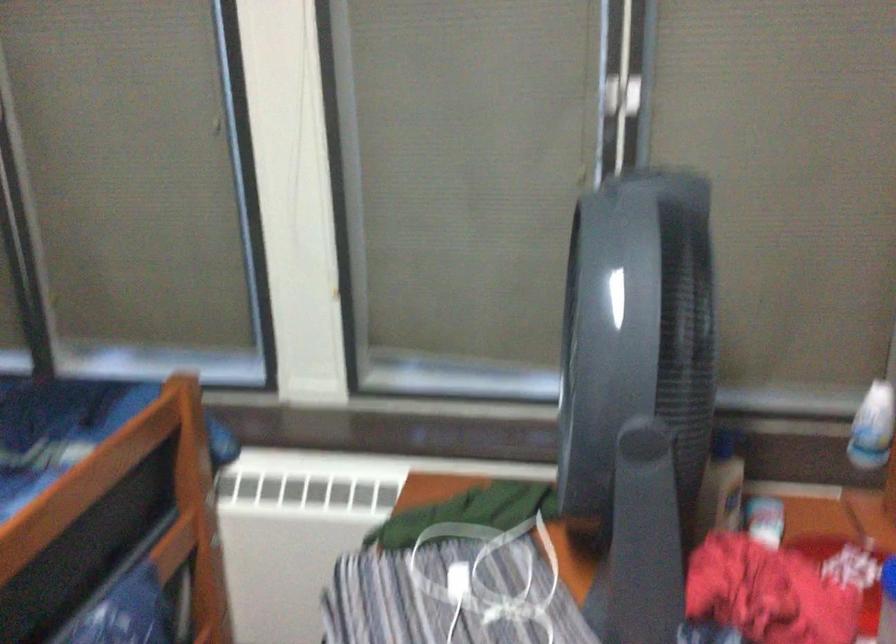
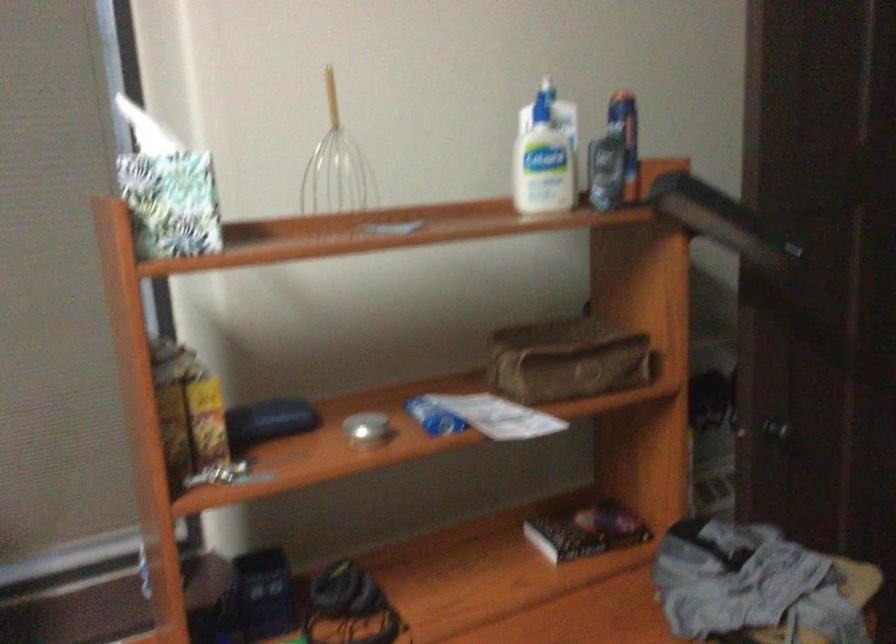
Question: The camera is either moving clockwise (left) or counter-clockwise (right) around the object. The first image is from the beginning of the video and the second image is from the end. Is the camera moving left or right when shooting the video?

Choices:
 (A) Left
 (B) Right

Answer: (A)